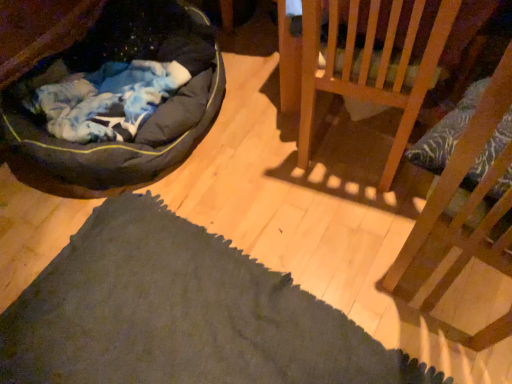
Question: From the image's perspective, is wooden chair at upper right, which is the 2th furniture in front-to-back order, located above or below wooden chair at right, acting as the 1th furniture starting from the front?

Choices:
 (A) below
 (B) above

Answer: (B)

Question: Considering their positions, is wooden chair at upper right, which is the 2th furniture in front-to-back order, located in front of or behind wooden chair at right, acting as the 1th furniture starting from the front?

Choices:
 (A) front
 (B) behind

Answer: (B)

Question: Estimate the real-world distances between objects in this image. Which object is farther from the dark gray fabric dog bed at left?

Choices:
 (A) wooden chair at right, acting as the 1th furniture starting from the front
 (B) wooden chair at upper right, arranged as the first furniture when viewed from the back

Answer: (A)

Question: Which object is positioned closest to the wooden chair at upper right, arranged as the first furniture when viewed from the back?

Choices:
 (A) wooden chair at right, marked as the second furniture in a back-to-front arrangement
 (B) dark gray fabric dog bed at left

Answer: (A)